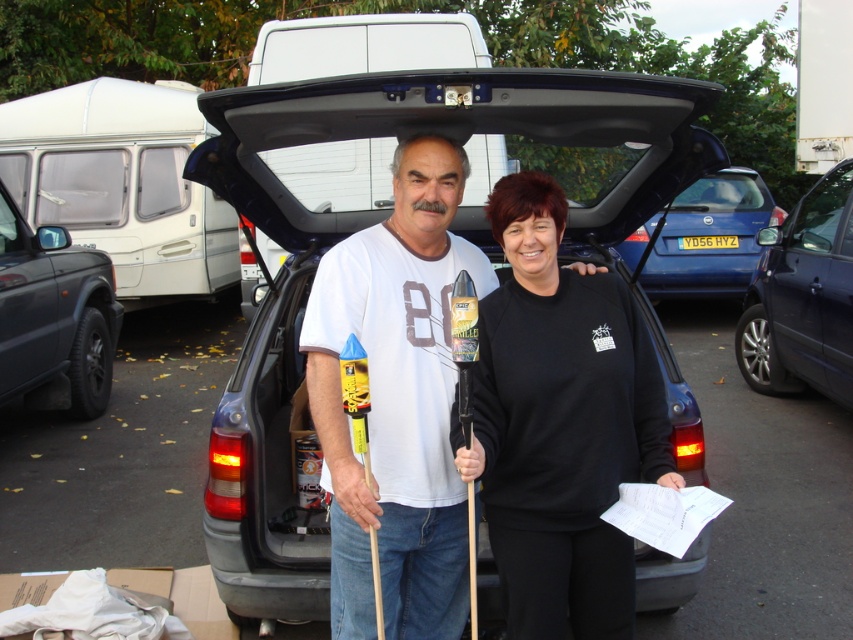
You are standing in front of the open car trunk and see two points marked inside it. The first point is at coordinates point (532, 246) and the second is at point (712, 225). Which point is closer to the front of the trunk?

Point (532, 246) is in front of point (712, 225), so it is closer to the front of the trunk.

In the scene shown: You are a delivery person trying to place a large package into the trunk. The package is too big to fit through the opening. You notice the black matte sweatshirt at center and the blue metallic hatchback at center. Which object should you move to gain more space?

The black matte sweatshirt at center is in front of the blue metallic hatchback at center, so moving the black matte sweatshirt at center would create more space in the trunk.

You are a delivery person who needs to place a large package in the trunk. The package is taller than the black matte sweatshirt at center. Can the package fit vertically in the trunk if the white matte van at center is already occupying space there?

The black matte sweatshirt at center is taller than the white matte van at center. Since the package is taller than the black matte sweatshirt at center, it would be even taller than the white matte van at center. However, the white matte van at center might be an object inside the trunk, but since the trunk is part of the car itself, there might be confusion. Wait, the objects are in the trunk? The scene mentions the trunk is open revealing some items. The objects listed are black matte sweatshirt at the